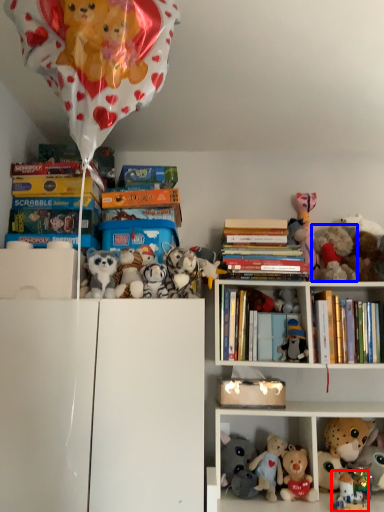
Question: Which of the following is the farthest to the observer, toy (highlighted by a red box) or toy (highlighted by a blue box)?

Choices:
 (A) toy
 (B) toy

Answer: (B)